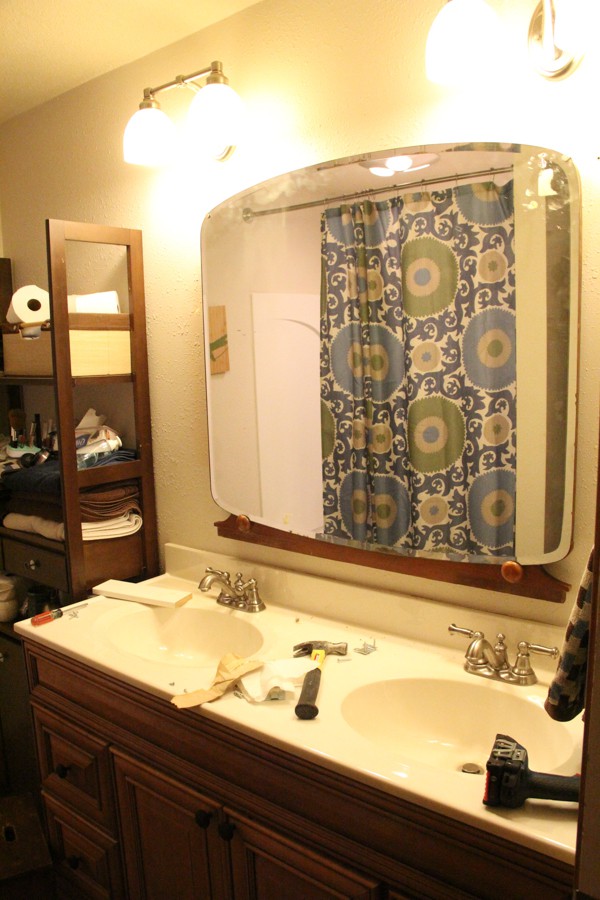
The image size is (600, 900). Identify the location of sink. (435, 715), (235, 626).